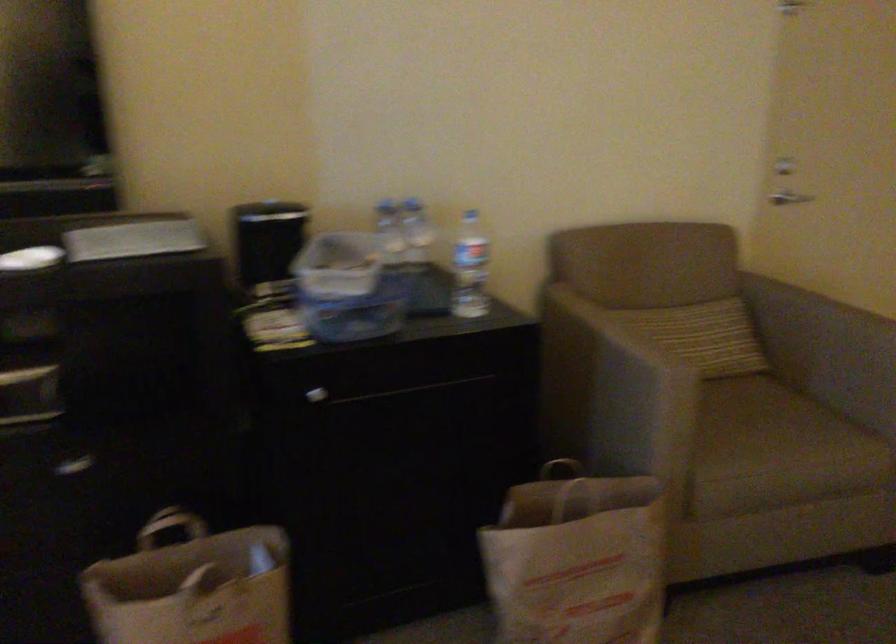
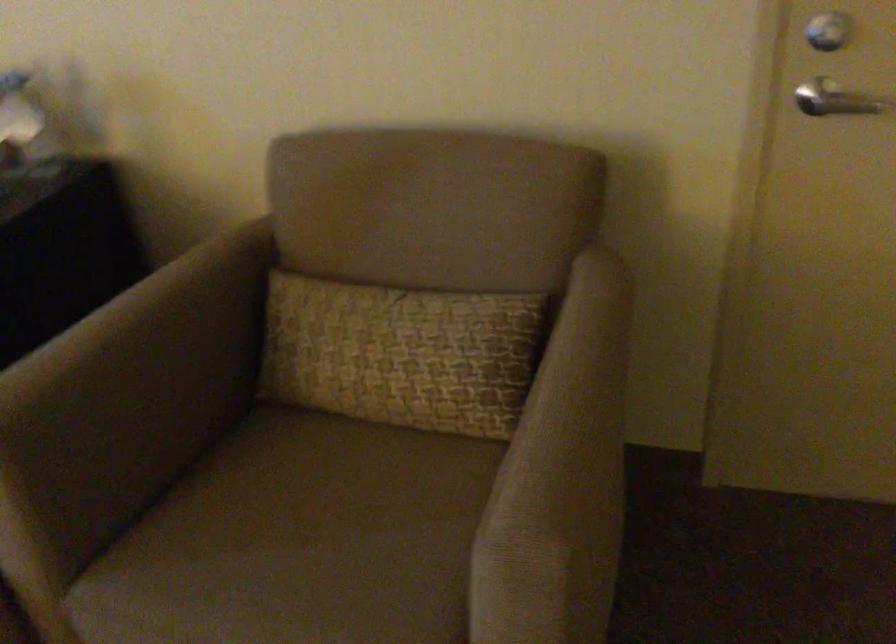
Where in the second image is the point corresponding to pixel 707 332 from the first image?

(401, 353)